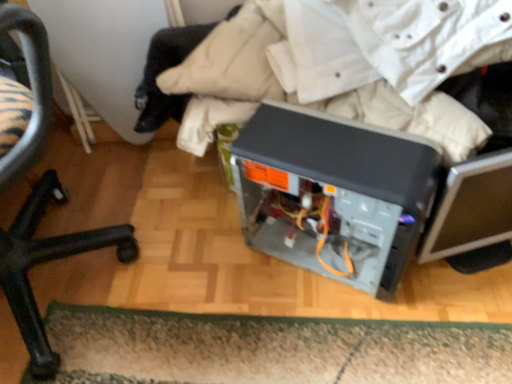
Question: From the image's perspective, is black plastic chair at lower left on green shaggy doormat at lower center?

Choices:
 (A) yes
 (B) no

Answer: (A)

Question: Does black plastic chair at lower left have a greater width compared to green shaggy doormat at lower center?

Choices:
 (A) no
 (B) yes

Answer: (B)

Question: From a real-world perspective, is black plastic chair at lower left beneath green shaggy doormat at lower center?

Choices:
 (A) yes
 (B) no

Answer: (B)

Question: Would you say green shaggy doormat at lower center is part of black plastic chair at lower left's contents?

Choices:
 (A) yes
 (B) no

Answer: (B)

Question: Is black plastic chair at lower left positioned in front of green shaggy doormat at lower center?

Choices:
 (A) yes
 (B) no

Answer: (A)

Question: Relative to black plastic chair at lower left, is green shaggy doormat at lower center in front or behind?

Choices:
 (A) front
 (B) behind

Answer: (B)

Question: Considering the positions of green shaggy doormat at lower center and black plastic chair at lower left in the image, is green shaggy doormat at lower center wider or thinner than black plastic chair at lower left?

Choices:
 (A) wide
 (B) thin

Answer: (B)

Question: From a real-world perspective, is green shaggy doormat at lower center above or below black plastic chair at lower left?

Choices:
 (A) below
 (B) above

Answer: (A)

Question: Choose the correct answer: Is green shaggy doormat at lower center inside black plastic chair at lower left or outside it?

Choices:
 (A) outside
 (B) inside

Answer: (A)

Question: Is black plastic chair at lower left inside the boundaries of green shaggy doormat at lower center, or outside?

Choices:
 (A) outside
 (B) inside

Answer: (A)

Question: Based on their sizes in the image, would you say black plastic chair at lower left is bigger or smaller than green shaggy doormat at lower center?

Choices:
 (A) big
 (B) small

Answer: (A)

Question: From a real-world perspective, is black plastic chair at lower left above or below green shaggy doormat at lower center?

Choices:
 (A) below
 (B) above

Answer: (B)

Question: Looking at their shapes, would you say black plastic chair at lower left is wider or thinner than green shaggy doormat at lower center?

Choices:
 (A) thin
 (B) wide

Answer: (B)

Question: In the image, is green shaggy doormat at lower center positioned in front of or behind satin black computer case at center?

Choices:
 (A) front
 (B) behind

Answer: (B)

Question: In terms of height, does green shaggy doormat at lower center look taller or shorter compared to satin black computer case at center?

Choices:
 (A) short
 (B) tall

Answer: (A)